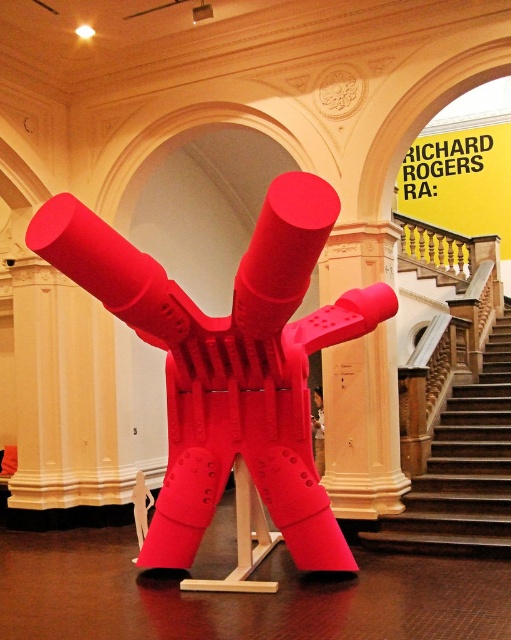
Question: Is matte plastic sculpture at center wider than wooden staircase at center?

Choices:
 (A) no
 (B) yes

Answer: (B)

Question: Which of the following is the closest to the observer?

Choices:
 (A) (326, 365)
 (B) (432, 481)
 (C) (196, 380)

Answer: (C)

Question: Can you confirm if matte plastic sculpture at center is positioned above wooden staircase at center?

Choices:
 (A) no
 (B) yes

Answer: (B)

Question: Which of the following is the closest to the observer?

Choices:
 (A) (472, 477)
 (B) (297, 481)
 (C) (377, 390)

Answer: (B)

Question: Which of the following is the closest to the observer?

Choices:
 (A) wooden staircase at center
 (B) matte white column at center

Answer: (A)

Question: Is matte plastic sculpture at center above wooden staircase at center?

Choices:
 (A) no
 (B) yes

Answer: (B)